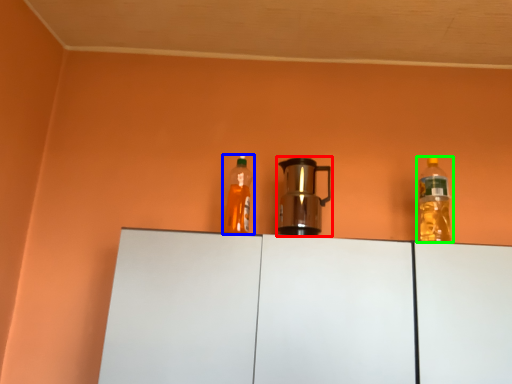
Question: Based on their relative distances, which object is farther from kitchen appliance (highlighted by a red box)? Choose from bottle (highlighted by a blue box) and bottle (highlighted by a green box).

Choices:
 (A) bottle
 (B) bottle

Answer: (B)